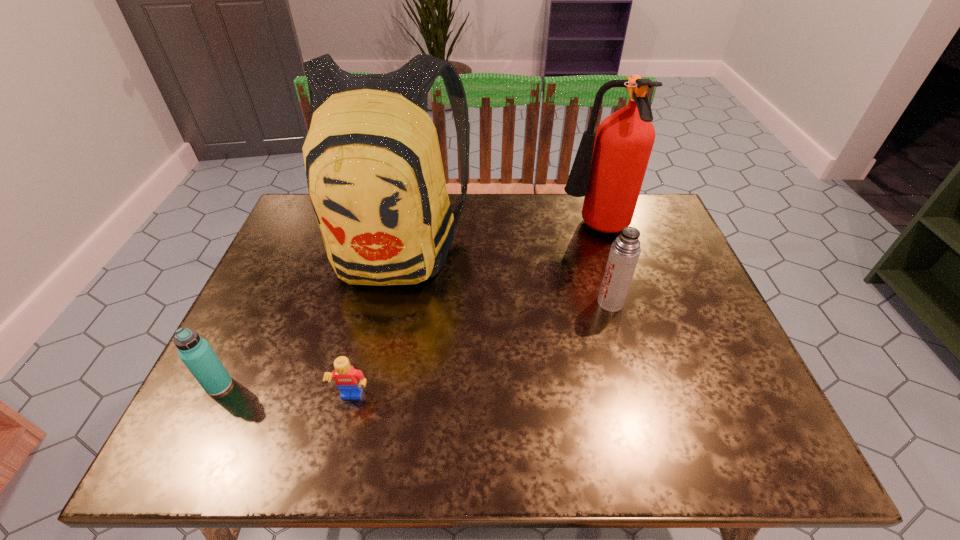
At what (x,y) coordinates should I click in order to perform the action: click on object located in the far right corner section of the desktop. Please return your answer as a coordinate pair (x, y). Looking at the image, I should click on (609, 173).

Image resolution: width=960 pixels, height=540 pixels. Find the location of `vacant space at the far edge`. vacant space at the far edge is located at coordinates (536, 234).

In the image, there is a desktop. Find the location of `vacant region at the near edge`. vacant region at the near edge is located at coordinates (679, 444).

In the image, there is a desktop. In order to click on vacant space at the left edge in this screenshot , I will do `click(313, 270)`.

At what (x,y) coordinates should I click in order to perform the action: click on vacant space at the near left corner of the desktop. Please return your answer as a coordinate pair (x, y). Looking at the image, I should click on (186, 454).

The width and height of the screenshot is (960, 540). In order to click on free space at the near right corner of the desktop in this screenshot , I will do (752, 429).

At what (x,y) coordinates should I click in order to perform the action: click on free space between the backpack and the shortest object. Please return your answer as a coordinate pair (x, y). The height and width of the screenshot is (540, 960). Looking at the image, I should click on (373, 322).

Image resolution: width=960 pixels, height=540 pixels. In order to click on free space between the backpack and the fire extinguisher in this screenshot , I will do click(x=495, y=238).

At what (x,y) coordinates should I click in order to perform the action: click on free space between the fire extinguisher and the farther thermos bottle. Please return your answer as a coordinate pair (x, y). The width and height of the screenshot is (960, 540). Looking at the image, I should click on (603, 266).

This screenshot has height=540, width=960. Find the location of `vacant area that lies between the nearer thermos bottle and the backpack`. vacant area that lies between the nearer thermos bottle and the backpack is located at coordinates (307, 315).